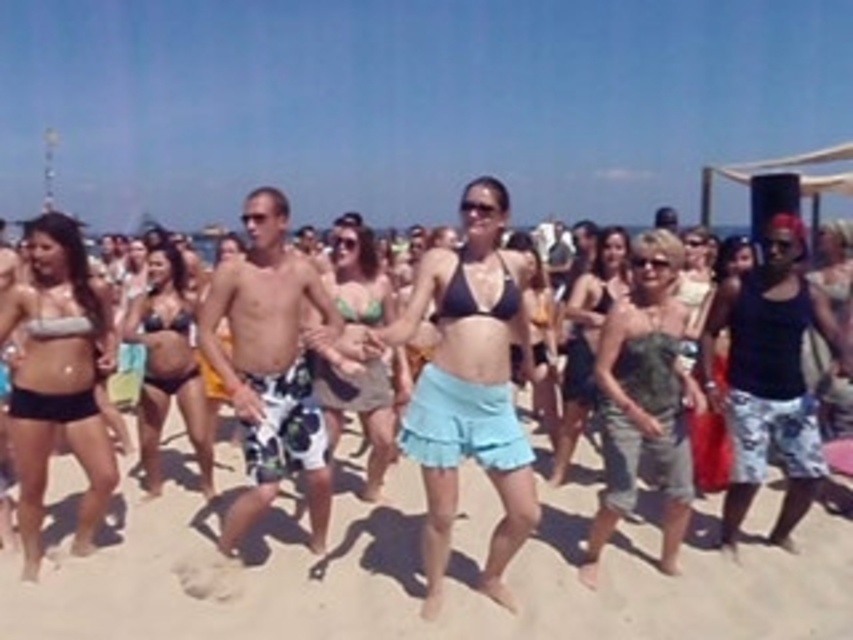
Question: Does light tan sand at center have a lesser width compared to dark blue tank top at center?

Choices:
 (A) no
 (B) yes

Answer: (A)

Question: Is camouflage fabric dress at center above matte black bikini at center?

Choices:
 (A) no
 (B) yes

Answer: (A)

Question: Estimate the real-world distances between objects in this image. Which object is closer to the matte black bikini top at left?

Choices:
 (A) matte black bikini at center
 (B) camouflage fabric dress at center
 (C) matte black bikini top at center

Answer: (A)

Question: Does matte black bikini top at left have a lesser width compared to green bikini top at center?

Choices:
 (A) yes
 (B) no

Answer: (A)

Question: Which of the following is the closest to the observer?

Choices:
 (A) green bikini top at center
 (B) matte black bikini at center
 (C) dark blue tank top at center

Answer: (A)

Question: Which point appears closest to the camera in this image?

Choices:
 (A) click(x=778, y=451)
 (B) click(x=294, y=388)

Answer: (B)